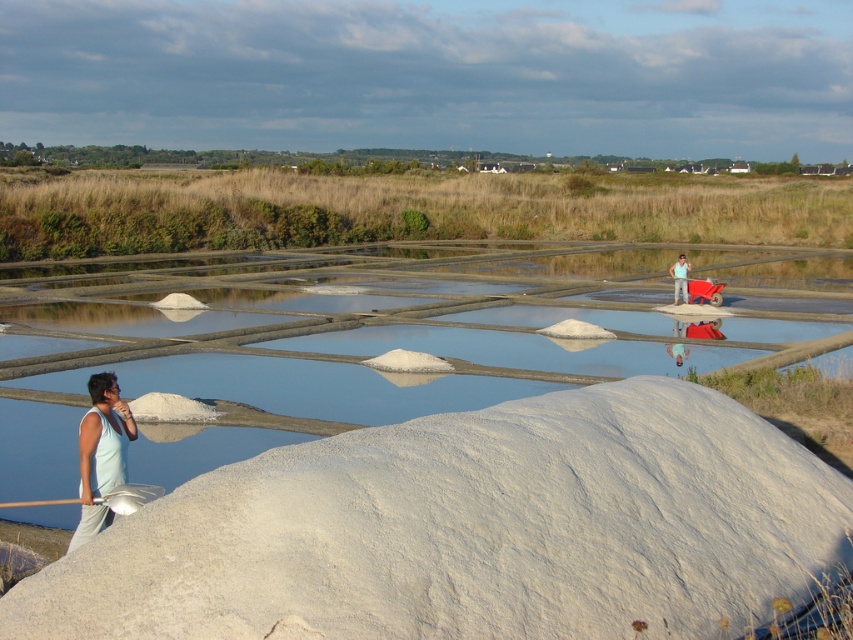
Based on the photo, you are a photographer standing in the middle of the salt marsh. You notice the white powdery cement at lower center and the light blue tank top at left. Which object is shorter in height?

The white powdery cement at lower center has a lesser height compared to the light blue tank top at left, so the white powdery cement at lower center is shorter in height.

You are a photographer standing in the salt marsh area. You want to capture both the green grassland at upper center and the light blue tank top at left in your photo. Which object should you focus on first if you want to include both in the frame?

The green grassland at upper center is bigger than the light blue tank top at left, so you should focus on the green grassland at upper center first to ensure it fits properly in the frame.

You are standing at the edge of the salt marsh and need to place a 3.5 meter long wooden board between the white powdery cement at lower center and the light blue tank top at left. Will the board reach both objects?

The distance between the white powdery cement at lower center and the light blue tank top at left is 3.05 meters, so a 3.5 meter long wooden board will be long enough to span the gap between them.